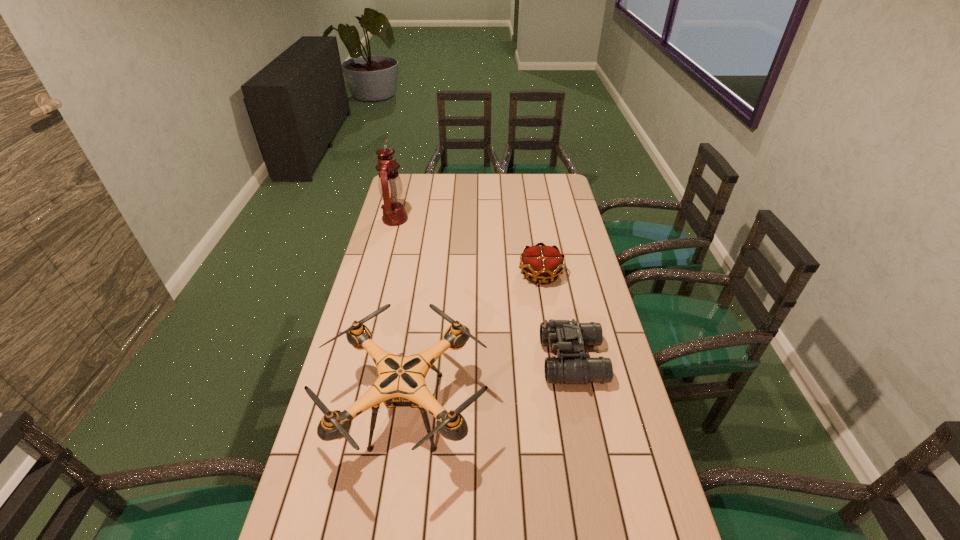
You are a GUI agent. You are given a task and a screenshot of the screen. Output one action in this format:
    pyautogui.click(x=<x>, y=<y>)
    Task: Click on the vacant space located 0.160m through the lenses of the second shortest object
    The image size is (960, 540).
    Given the screenshot: What is the action you would take?
    pyautogui.click(x=491, y=360)

The image size is (960, 540). What are the coordinates of `free spot located on the back of the shortest object` in the screenshot? It's located at [x=531, y=212].

The width and height of the screenshot is (960, 540). In order to click on oil lamp at the left edge in this screenshot , I will do [390, 186].

Where is `drone that is at the left edge`? Image resolution: width=960 pixels, height=540 pixels. drone that is at the left edge is located at coordinates (401, 383).

Where is `binoculars present at the right edge`? This screenshot has height=540, width=960. binoculars present at the right edge is located at coordinates (571, 366).

Where is `crown that is at the right edge`? The width and height of the screenshot is (960, 540). crown that is at the right edge is located at coordinates (543, 262).

What are the coordinates of `free space at the far edge` in the screenshot? It's located at (460, 177).

In the image, there is a desktop. In order to click on vacant region at the left edge in this screenshot , I will do `click(401, 227)`.

In the image, there is a desktop. Where is `vacant space at the right edge`? This screenshot has width=960, height=540. vacant space at the right edge is located at coordinates (612, 489).

Identify the location of blank space at the far left corner. Image resolution: width=960 pixels, height=540 pixels. 406,174.